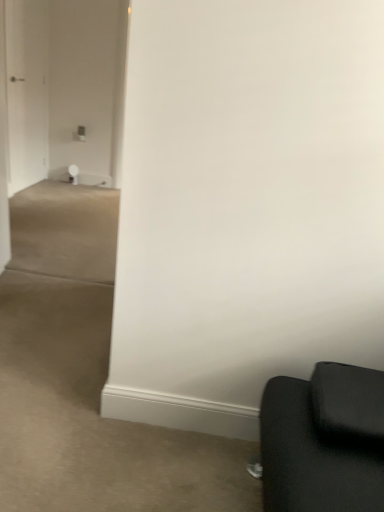
Question: Is white glossy door at left spatially inside white glossy door at upper left, or outside of it?

Choices:
 (A) inside
 (B) outside

Answer: (B)

Question: Is white glossy door at left bigger or smaller than white glossy door at upper left?

Choices:
 (A) small
 (B) big

Answer: (A)

Question: Considering the positions of white glossy door at left and white glossy door at upper left in the image, is white glossy door at left taller or shorter than white glossy door at upper left?

Choices:
 (A) short
 (B) tall

Answer: (A)

Question: Is white glossy door at upper left situated inside white glossy door at left or outside?

Choices:
 (A) outside
 (B) inside

Answer: (A)

Question: From the image's perspective, relative to white glossy door at left, is white glossy door at upper left above or below?

Choices:
 (A) above
 (B) below

Answer: (A)

Question: Based on their sizes in the image, would you say white glossy door at upper left is bigger or smaller than white glossy door at left?

Choices:
 (A) small
 (B) big

Answer: (B)

Question: Is point (16, 48) positioned closer to the camera than point (1, 74)?

Choices:
 (A) farther
 (B) closer

Answer: (A)